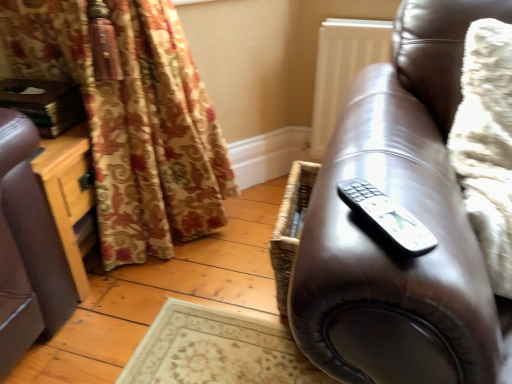
This screenshot has width=512, height=384. In order to click on matte brown leather couch at right in this screenshot , I will do `click(409, 210)`.

What do you see at coordinates (409, 210) in the screenshot? The height and width of the screenshot is (384, 512). I see `matte brown leather couch at right` at bounding box center [409, 210].

I want to click on white plastic remote at right, so click(x=388, y=217).

The image size is (512, 384). What do you see at coordinates (388, 217) in the screenshot? I see `white plastic remote at right` at bounding box center [388, 217].

Measure the distance between point (413, 227) and camera.

Point (413, 227) is 48.20 centimeters away from camera.

The height and width of the screenshot is (384, 512). I want to click on matte brown leather couch at right, so click(x=409, y=210).

Is white plastic remote at right at the left side of matte brown leather couch at right?

Yes.

Does white plastic remote at right lie behind matte brown leather couch at right?

Yes, it is.

Does point (350, 198) come in front of point (358, 134)?

Yes, point (350, 198) is in front of point (358, 134).

From the image's perspective, which object appears higher, white plastic remote at right or matte brown leather couch at right?

white plastic remote at right.

From a real-world perspective, is white plastic remote at right physically located above or below matte brown leather couch at right?

In terms of real-world spatial position, white plastic remote at right is above matte brown leather couch at right.

Considering the sizes of objects white plastic remote at right and matte brown leather couch at right in the image provided, who is wider, white plastic remote at right or matte brown leather couch at right?

matte brown leather couch at right.

Between white plastic remote at right and matte brown leather couch at right, which one has more height?

With more height is matte brown leather couch at right.

Looking at the image, does white plastic remote at right seem bigger or smaller compared to matte brown leather couch at right?

In the image, white plastic remote at right appears to be smaller than matte brown leather couch at right.

Based on the photo, would you say white plastic remote at right is inside or outside matte brown leather couch at right?

white plastic remote at right lies within the bounds of matte brown leather couch at right.

Is white plastic remote at right directly adjacent to matte brown leather couch at right?

No, white plastic remote at right is not touching matte brown leather couch at right.

Is white plastic remote at right aimed at matte brown leather couch at right?

Yes, white plastic remote at right is turned towards matte brown leather couch at right.

Identify the location of remote above the matte brown leather couch at right (from the image's perspective). The width and height of the screenshot is (512, 384). (388, 217).

Considering the relative positions of matte brown leather couch at right and white plastic remote at right in the image provided, is matte brown leather couch at right to the left or to the right of white plastic remote at right?

Clearly, matte brown leather couch at right is on the right of white plastic remote at right in the image.

Considering the positions of objects matte brown leather couch at right and white plastic remote at right in the image provided, who is in front, matte brown leather couch at right or white plastic remote at right?

matte brown leather couch at right is more forward.

Which is in front, point (426, 58) or point (423, 226)?

The point (423, 226) is in front.

From the image's perspective, is matte brown leather couch at right above white plastic remote at right?

Actually, matte brown leather couch at right appears below white plastic remote at right in the image.

From a real-world perspective, is matte brown leather couch at right physically located above or below white plastic remote at right?

From a real-world perspective, matte brown leather couch at right is physically below white plastic remote at right.

Can you confirm if matte brown leather couch at right is wider than white plastic remote at right?

Yes, matte brown leather couch at right is wider than white plastic remote at right.

Between matte brown leather couch at right and white plastic remote at right, which one has less height?

white plastic remote at right is shorter.

Considering the relative sizes of matte brown leather couch at right and white plastic remote at right in the image provided, is matte brown leather couch at right smaller than white plastic remote at right?

Incorrect, matte brown leather couch at right is not smaller in size than white plastic remote at right.

Is matte brown leather couch at right positioned beyond the bounds of white plastic remote at right?

Yes, matte brown leather couch at right is located beyond the bounds of white plastic remote at right.

Is matte brown leather couch at right next to white plastic remote at right?

No, matte brown leather couch at right is not beside white plastic remote at right.

Is white plastic remote at right at the back of matte brown leather couch at right?

That's not correct — matte brown leather couch at right is not looking away from white plastic remote at right.

What's the angular difference between matte brown leather couch at right and white plastic remote at right's facing directions?

The angle between the facing direction of matte brown leather couch at right and the facing direction of white plastic remote at right is 36.7 degrees.

Measure the distance from matte brown leather couch at right to white plastic remote at right.

They are 23.25 centimeters apart.

Locate an element on the screen. This screenshot has width=512, height=384. remote that is behind the matte brown leather couch at right is located at coordinates (388, 217).

The height and width of the screenshot is (384, 512). Identify the location of studio couch below the white plastic remote at right (from the image's perspective). (409, 210).

Locate an element on the screen. studio couch to the right of white plastic remote at right is located at coordinates (409, 210).